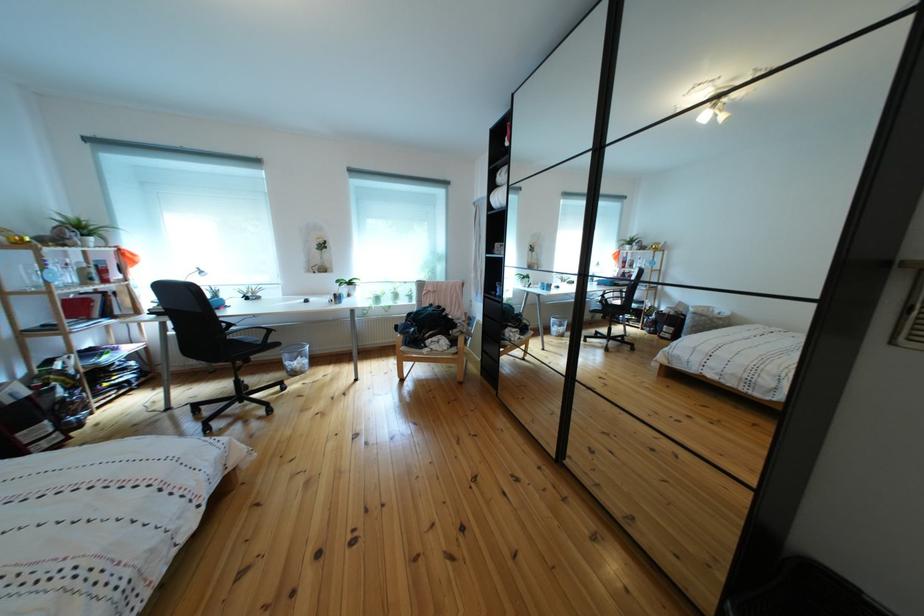
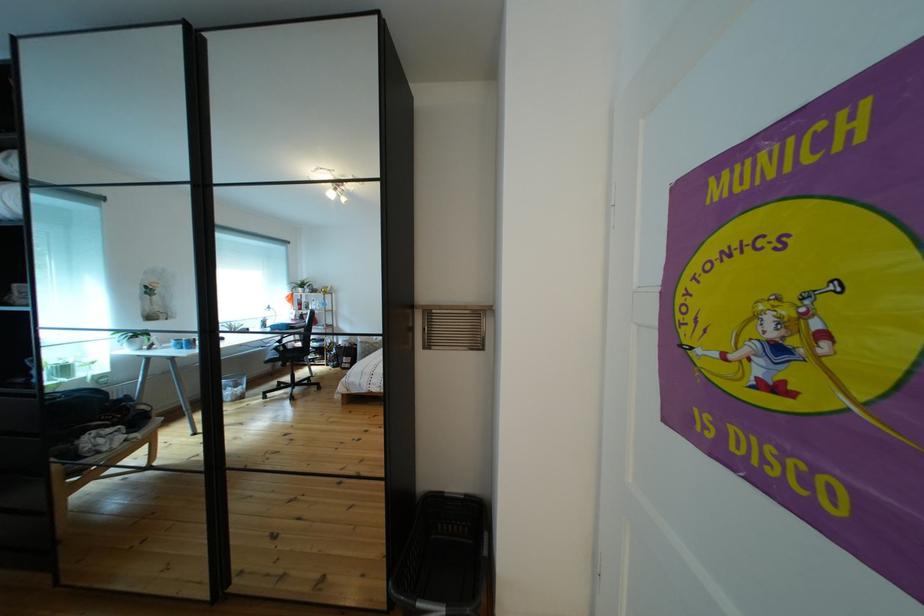
Question: The camera is either moving clockwise (left) or counter-clockwise (right) around the object. The first image is from the beginning of the video and the second image is from the end. Is the camera moving left or right when shooting the video?

Choices:
 (A) Left
 (B) Right

Answer: (A)